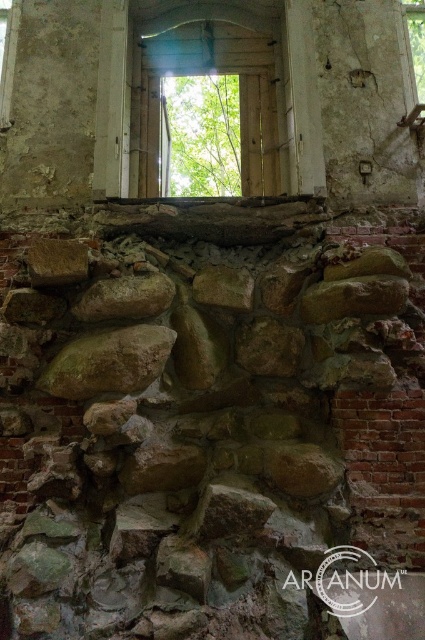
Is transparent wooden door at upper center thinner than brown rough stone at center?

In fact, transparent wooden door at upper center might be wider than brown rough stone at center.

Who is taller, transparent wooden door at upper center or brown rough stone at center?

With more height is transparent wooden door at upper center.

Locate an element on the screen. transparent wooden door at upper center is located at coordinates (215, 77).

From the picture: Who is higher up, transparent wooden door at upper center or green rough stone at center?

transparent wooden door at upper center is higher up.

Is transparent wooden door at upper center positioned at the back of green rough stone at center?

Yes.

At what (x,y) coordinates should I click in order to perform the action: click on transparent wooden door at upper center. Please return your answer as a coordinate pair (x, y). The width and height of the screenshot is (425, 640). Looking at the image, I should click on (215, 77).

This screenshot has height=640, width=425. Find the location of `transparent wooden door at upper center`. transparent wooden door at upper center is located at coordinates (215, 77).

Does green rough stone at center have a lesser width compared to brown rough stone at center?

In fact, green rough stone at center might be wider than brown rough stone at center.

Does green rough stone at center appear under brown rough stone at center?

Indeed, green rough stone at center is positioned under brown rough stone at center.

Who is more distant from viewer, (53, 362) or (124, 284)?

Positioned behind is point (124, 284).

Locate an element on the screen. This screenshot has width=425, height=640. green rough stone at center is located at coordinates (108, 362).